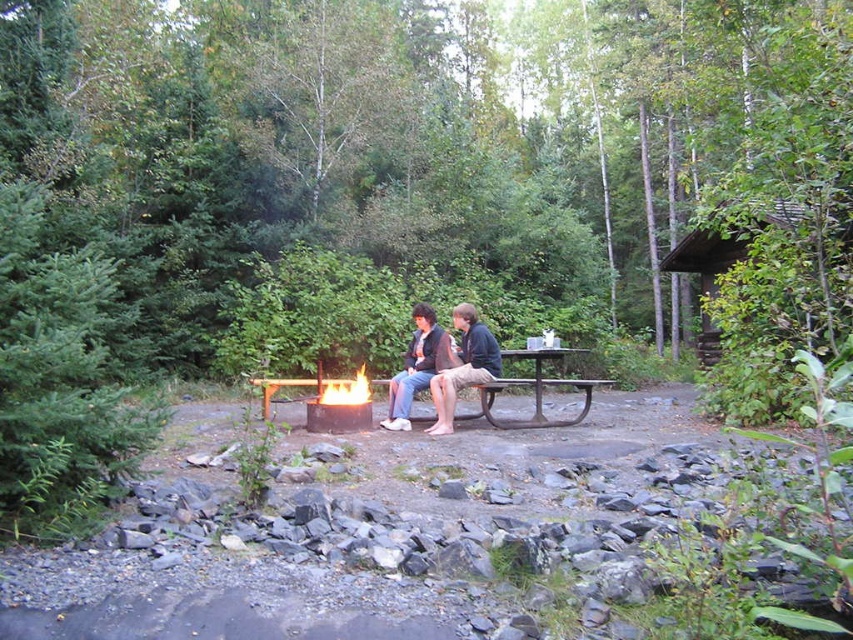
From the picture: Which of these two, metallic dark brown picnic table at center or flamematerial/texturefire at center, stands taller?

With more height is metallic dark brown picnic table at center.

How much distance is there between metallic dark brown picnic table at center and flamematerial/texturefire at center?

metallic dark brown picnic table at center is 4.12 feet away from flamematerial/texturefire at center.

The image size is (853, 640). Describe the element at coordinates (537, 388) in the screenshot. I see `metallic dark brown picnic table at center` at that location.

Where is `metallic dark brown picnic table at center`? metallic dark brown picnic table at center is located at coordinates (537, 388).

Does dark brown leather jacket at center appear on the right side of brown wooden cabin at upper right?

No, dark brown leather jacket at center is not to the right of brown wooden cabin at upper right.

Is dark brown leather jacket at center taller than brown wooden cabin at upper right?

Correct, dark brown leather jacket at center is much taller as brown wooden cabin at upper right.

Who is more forward, [392,413] or [723,266]?

Point [392,413] is in front.

Find the location of a particular element. dark brown leather jacket at center is located at coordinates (460, 364).

Does dark brown leather jacket at center have a lesser height compared to metallic dark brown picnic table at center?

Incorrect, dark brown leather jacket at center's height does not fall short of metallic dark brown picnic table at center's.

Locate an element on the screen. This screenshot has height=640, width=853. dark brown leather jacket at center is located at coordinates (460, 364).

Is point (453, 374) in front of point (535, 355)?

Yes, point (453, 374) is in front of point (535, 355).

Find the location of a particular element. dark brown leather jacket at center is located at coordinates (460, 364).